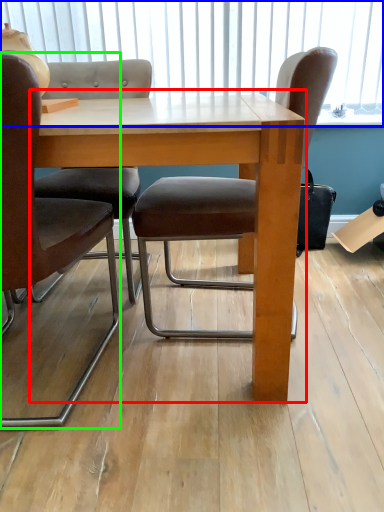
Question: Which is nearer to the table (highlighted by a red box)? window screen (highlighted by a blue box) or chair (highlighted by a green box).

Choices:
 (A) window screen
 (B) chair

Answer: (B)